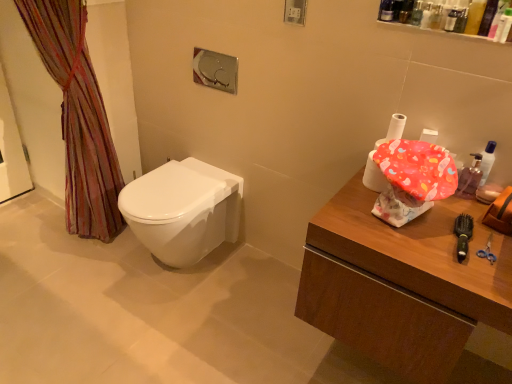
Where is `free space above wooden counter at right (from a real-world perspective)`? Image resolution: width=512 pixels, height=384 pixels. free space above wooden counter at right (from a real-world perspective) is located at coordinates (440, 234).